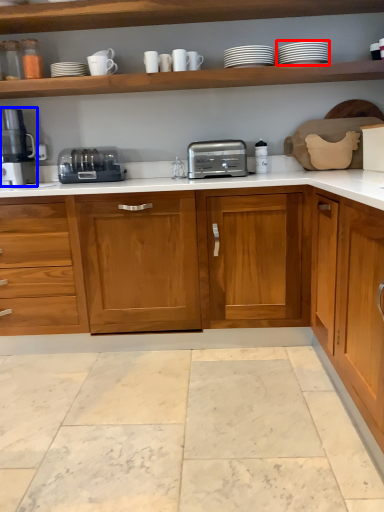
Question: Which object appears farthest to the camera in this image, tableware (highlighted by a red box) or coffee machine (highlighted by a blue box)?

Choices:
 (A) tableware
 (B) coffee machine

Answer: (B)